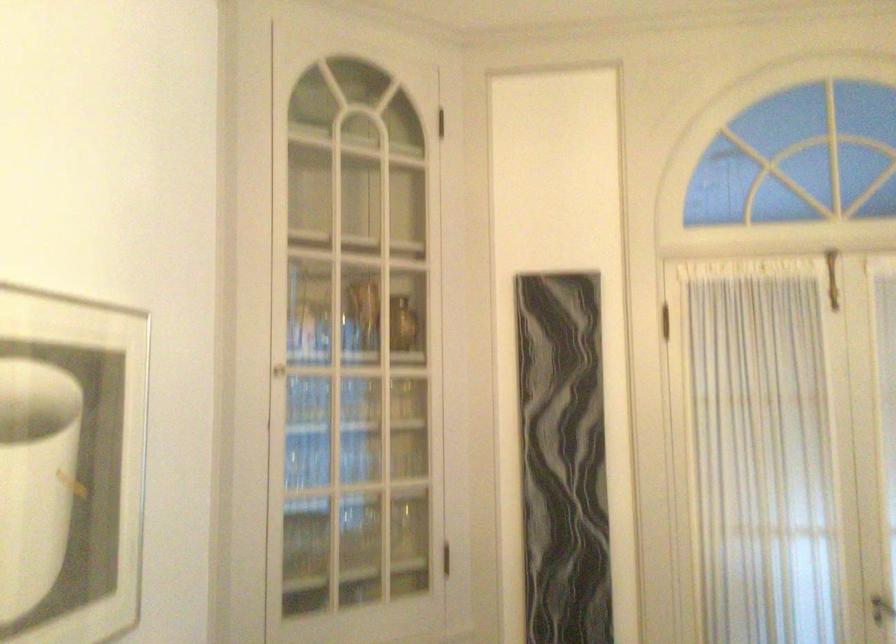
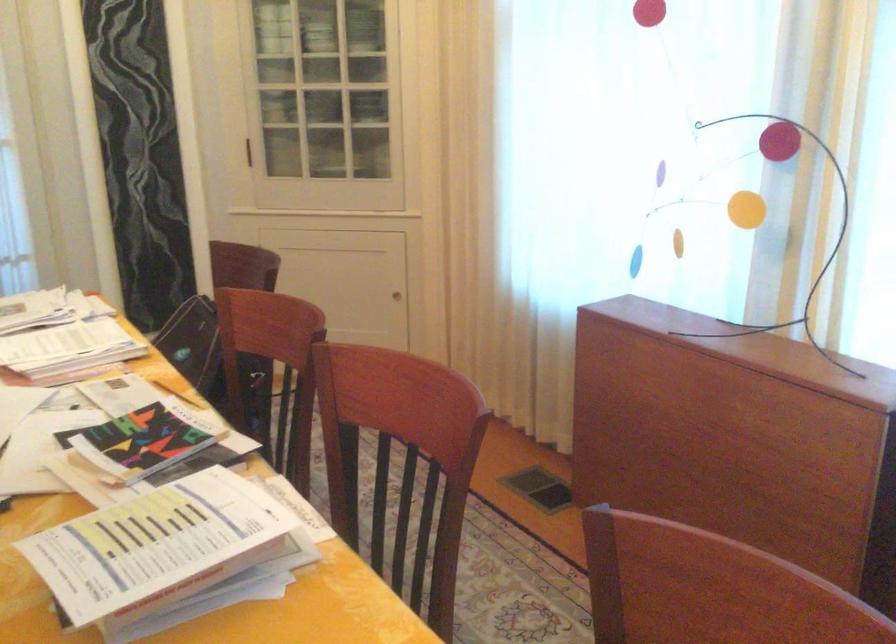
How did the camera likely rotate?

The camera's rotation is toward right-down.